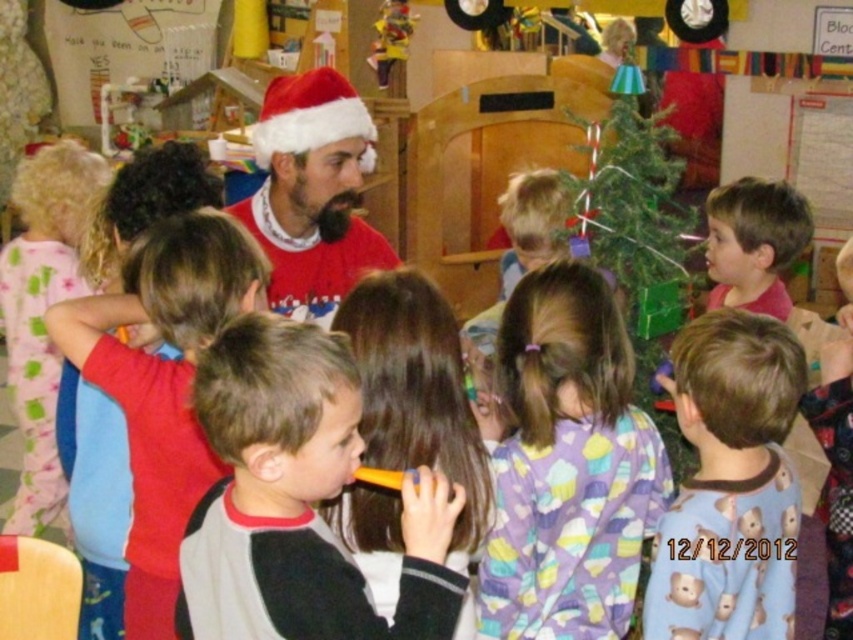
Question: Does white cotton shirt at center appear on the left side of green matte christmas tree at center?

Choices:
 (A) yes
 (B) no

Answer: (A)

Question: Which point is closer to the camera?

Choices:
 (A) (339, 208)
 (B) (271, 465)
 (C) (744, 288)

Answer: (B)

Question: Is gray fleece shirt at center wider than white cotton shirt at center?

Choices:
 (A) no
 (B) yes

Answer: (B)

Question: Which of these objects is positioned farthest from the green matte christmas tree at center?

Choices:
 (A) purple cotton pajamas at center
 (B) fuzzy red sweater at center

Answer: (B)

Question: In this image, where is purple cotton pajamas at center located relative to fuzzy red sweater at center?

Choices:
 (A) above
 (B) below

Answer: (B)

Question: Among these points, which one is nearest to the camera?

Choices:
 (A) (352, 497)
 (B) (36, 520)
 (C) (250, 220)
 (D) (769, 358)

Answer: (A)